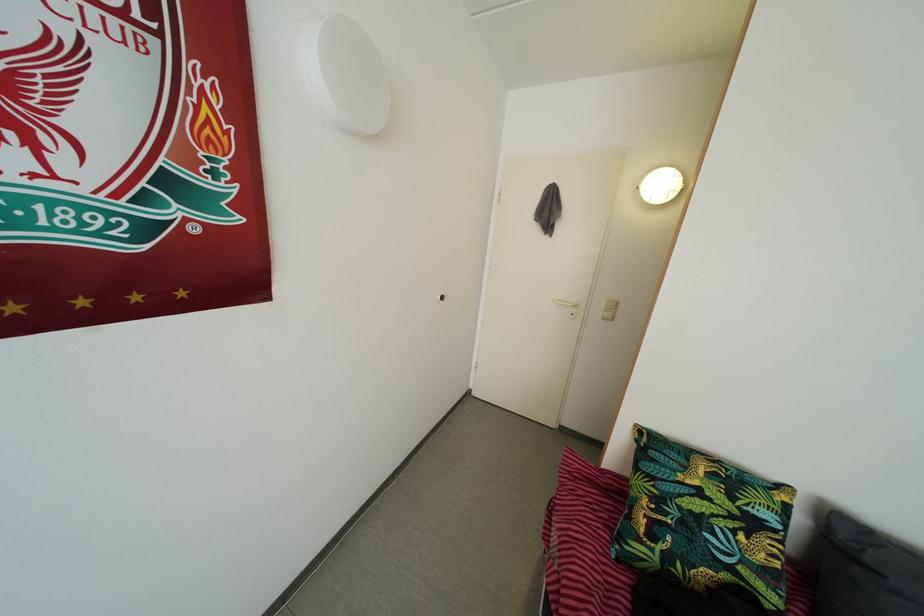
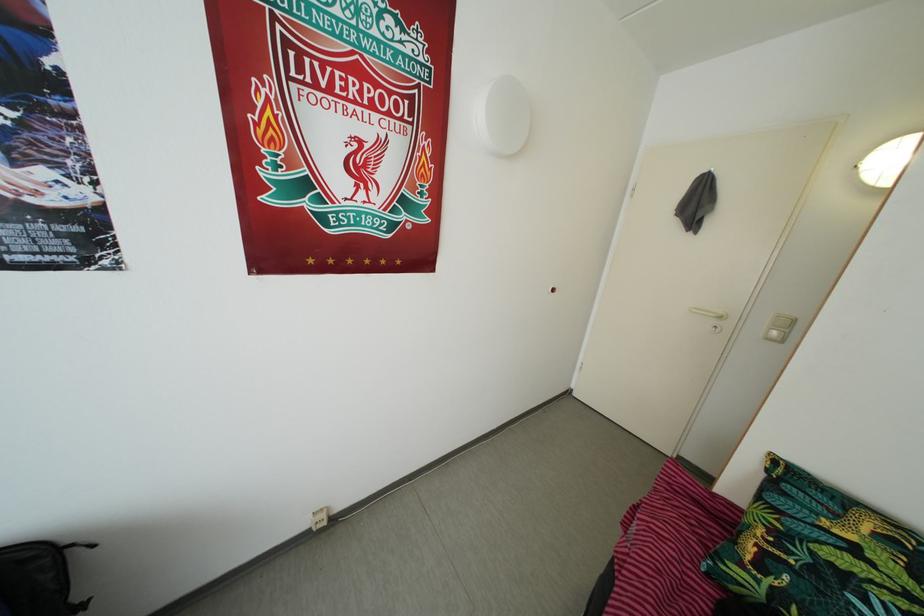
The point at (624, 568) is marked in the first image. Where is the corresponding point in the second image?

(714, 583)